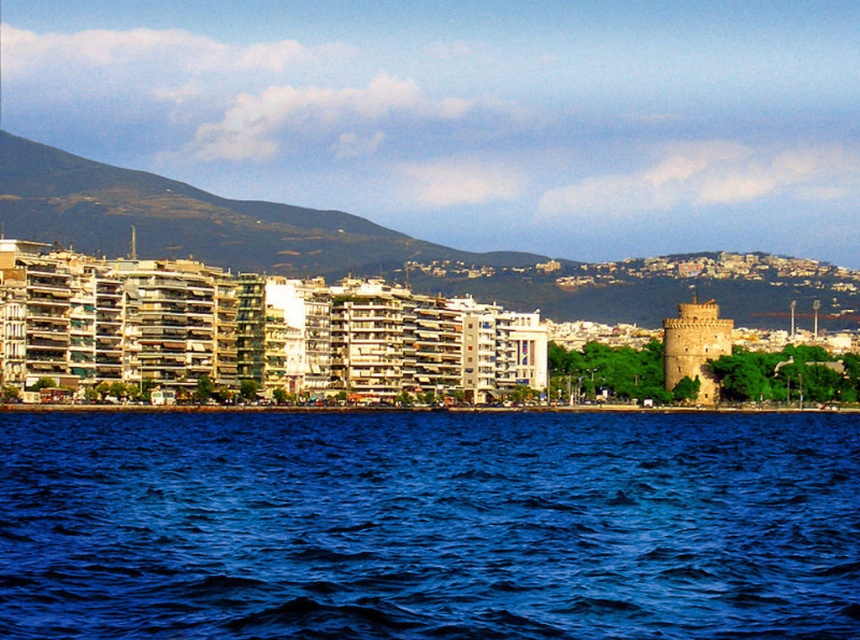
Question: Which is nearer to the light brown stone tower at right?

Choices:
 (A) green textured mountain at upper left
 (B) blue liquid water at lower center

Answer: (B)

Question: Observing the image, what is the correct spatial positioning of green textured mountain at upper left in reference to light brown stone tower at right?

Choices:
 (A) above
 (B) below

Answer: (A)

Question: Is blue liquid water at lower center to the right of light brown stone tower at right from the viewer's perspective?

Choices:
 (A) yes
 (B) no

Answer: (B)

Question: Is blue liquid water at lower center bigger than green textured mountain at upper left?

Choices:
 (A) yes
 (B) no

Answer: (B)

Question: Considering the real-world distances, which object is farthest from the light brown stone tower at right?

Choices:
 (A) green textured mountain at upper left
 (B) blue liquid water at lower center

Answer: (A)

Question: Which point appears farthest from the camera in this image?

Choices:
 (A) (679, 333)
 (B) (321, 422)

Answer: (A)